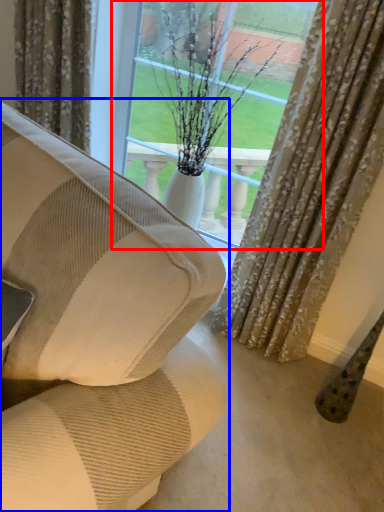
Question: Which of the following is the closest to the observer, window (highlighted by a red box) or studio couch (highlighted by a blue box)?

Choices:
 (A) window
 (B) studio couch

Answer: (B)